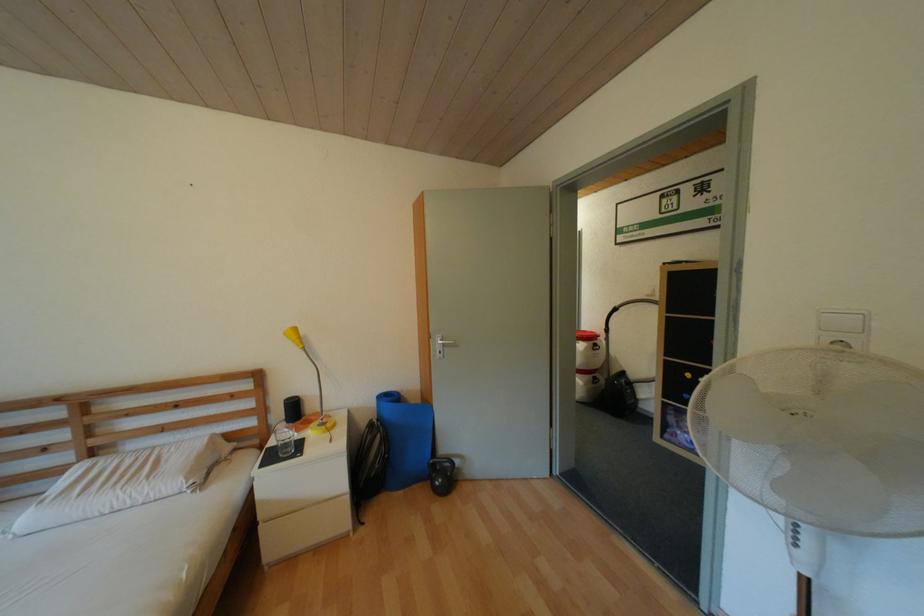
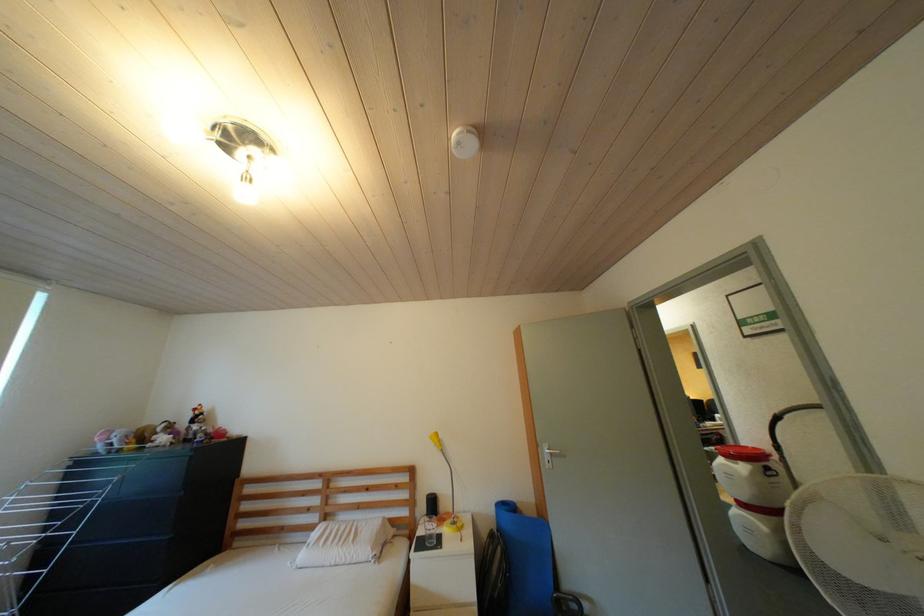
In the second image, find the point that corresponds to point (321, 434) in the first image.

(456, 531)